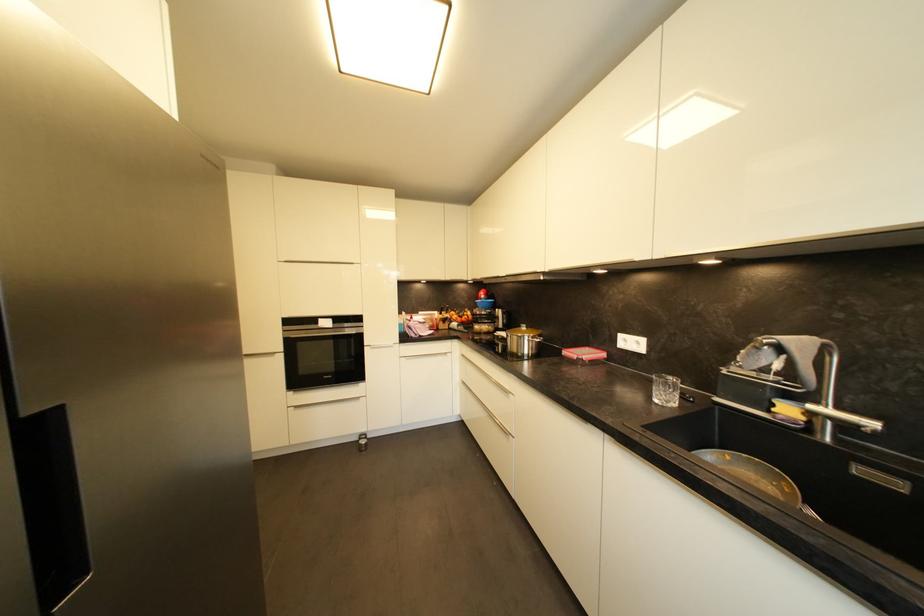
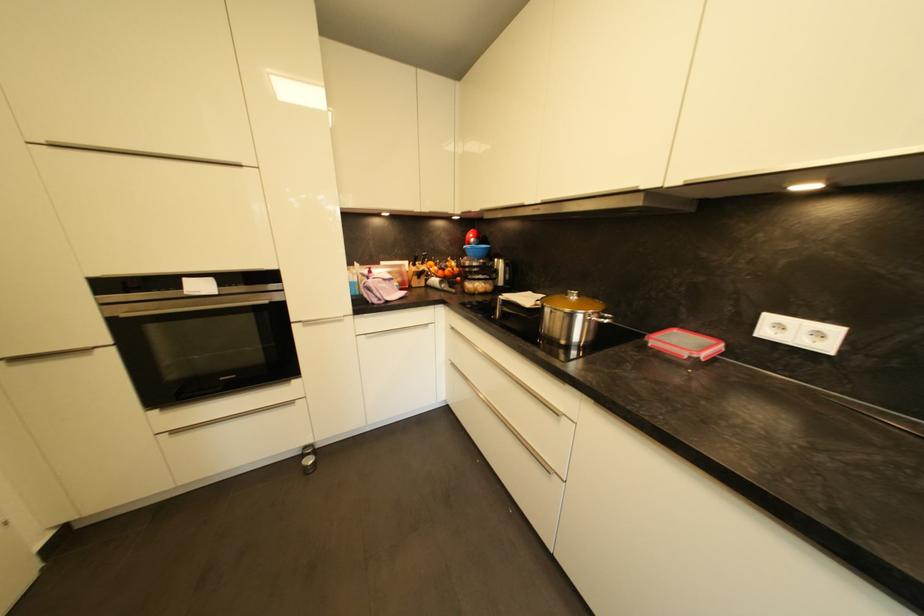
Locate, in the second image, the point that corresponds to (467,424) in the first image.

(453, 408)